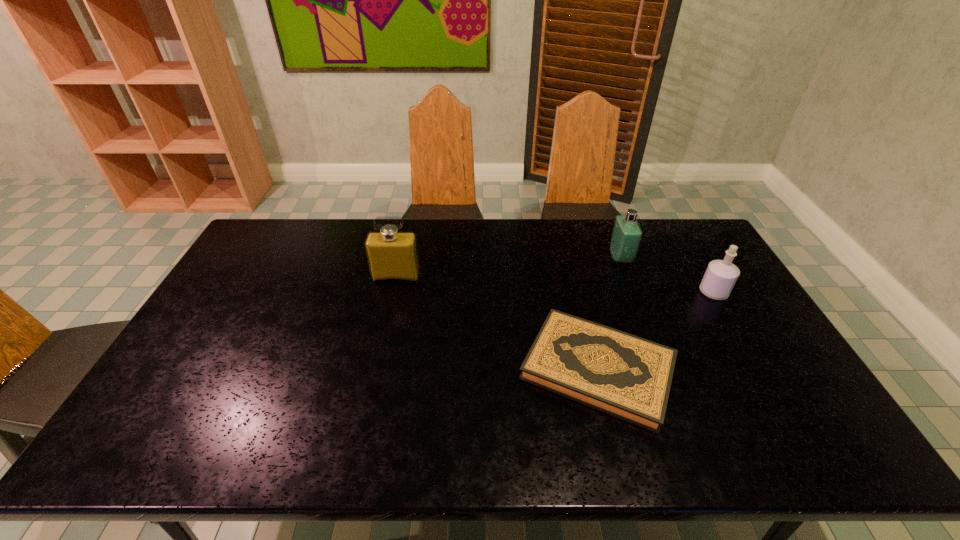
You are a GUI agent. You are given a task and a screenshot of the screen. Output one action in this format:
    pyautogui.click(x=<x>, y=<y>)
    Task: Click on the free space located 0.340m on the front of the rightmost object
    Image resolution: width=960 pixels, height=540 pixels.
    Given the screenshot: What is the action you would take?
    pyautogui.click(x=774, y=395)

Where is `free spot located 0.330m on the back of the hardback book`? This screenshot has height=540, width=960. free spot located 0.330m on the back of the hardback book is located at coordinates (568, 251).

Image resolution: width=960 pixels, height=540 pixels. I want to click on object situated at the far edge, so click(x=626, y=236).

Where is `object at the near edge`? This screenshot has width=960, height=540. object at the near edge is located at coordinates (628, 377).

This screenshot has height=540, width=960. Identify the location of object that is at the right edge. (720, 277).

Find the location of `vacant space at the near edge of the desktop`. vacant space at the near edge of the desktop is located at coordinates (729, 440).

Identify the location of free space at the left edge of the desktop. (214, 302).

Find the location of a particular element. The height and width of the screenshot is (540, 960). vacant space at the right edge of the desktop is located at coordinates (731, 335).

The height and width of the screenshot is (540, 960). In the image, there is a desktop. Identify the location of free space at the far left corner. (290, 225).

Where is `vacant space in between the rightmost object and the second perfume from right to left`? Image resolution: width=960 pixels, height=540 pixels. vacant space in between the rightmost object and the second perfume from right to left is located at coordinates (667, 275).